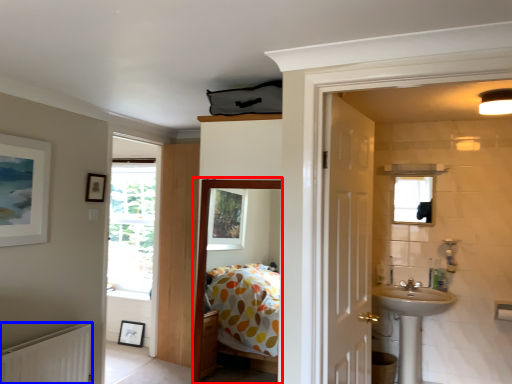
Question: Which object is closer to the camera taking this photo, corridor (highlighted by a red box) or radiator (highlighted by a blue box)?

Choices:
 (A) corridor
 (B) radiator

Answer: (A)